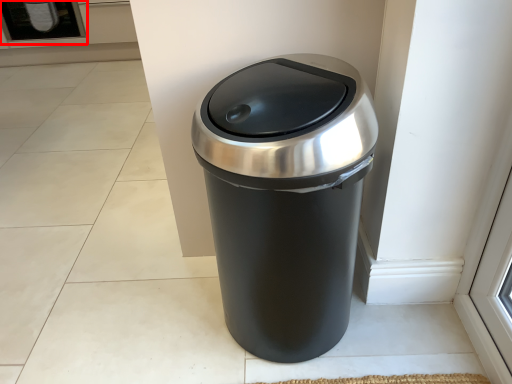
Question: In this image, where is screen door (annotated by the red box) located relative to waste container?

Choices:
 (A) right
 (B) left

Answer: (B)